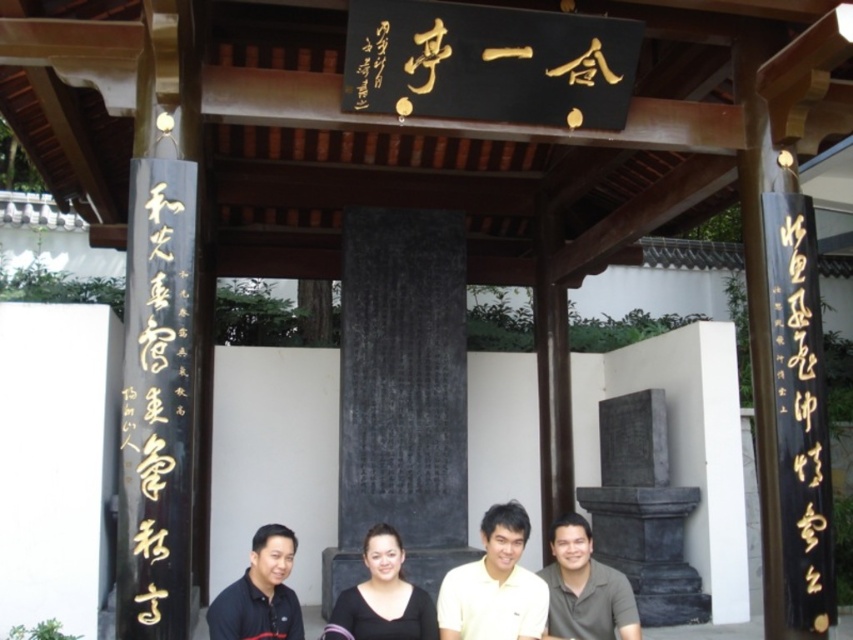
Question: Which object appears farthest from the camera in this image?

Choices:
 (A) black calligraphy at left
 (B) black matte dress at center

Answer: (B)

Question: Can you confirm if black calligraphy at left is positioned to the right of yellow cotton shirt at center?

Choices:
 (A) no
 (B) yes

Answer: (A)

Question: From the image, what is the correct spatial relationship of black shirt at center in relation to matte gray shirt at lower right?

Choices:
 (A) left
 (B) right

Answer: (A)

Question: Is black calligraphy at left wider than matte gray shirt at lower right?

Choices:
 (A) no
 (B) yes

Answer: (A)

Question: Which point is farther to the camera?

Choices:
 (A) black matte dress at center
 (B) yellow cotton shirt at center

Answer: (B)

Question: Which point is farther to the camera?

Choices:
 (A) yellow cotton shirt at center
 (B) black shirt at center

Answer: (A)